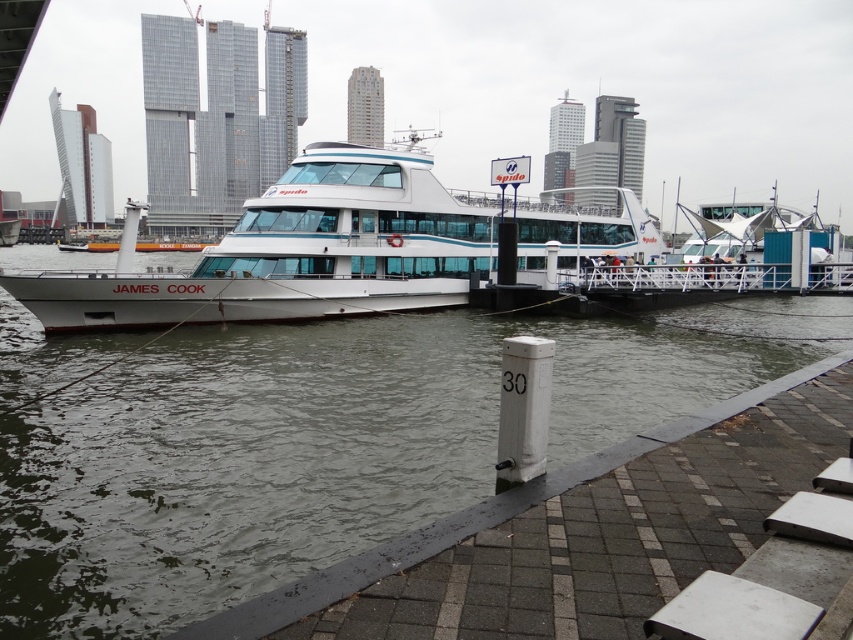
You are a passenger on the white glossy ferry at center and want to disembark at the nearest dock. Which direction should you go relative to the clear water at boat left?

Since the clear water at boat left is in front of the white glossy ferry at center, you should go in the opposite direction of the clear water at boat left to reach the nearest dock.

You are a tour guide explaining the waterfront to a group. Pointing to the clear water at boat left and the white glossy ferry at center, you want to mention their sizes. Which one is wider?

The clear water at boat left is narrower than the white glossy ferry at center since its width is less than the ferry.

You are a passenger on the white glossy ferry at center and want to take a photo of the clear water at boat left. Which direction should you point your camera?

The clear water at boat left is positioned on the left side of the white glossy ferry at center, so you should point your camera to the left side to capture the clear water at boat left.